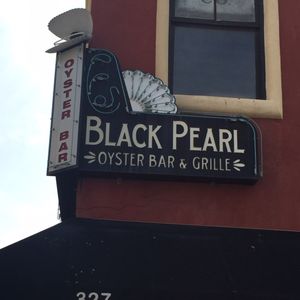
Image resolution: width=300 pixels, height=300 pixels. Identify the location of black canopy. (195, 257).